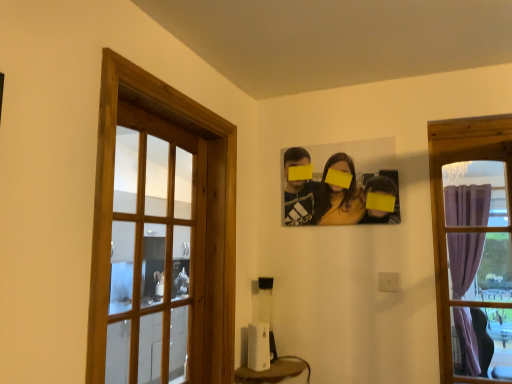
Image resolution: width=512 pixels, height=384 pixels. What are the coordinates of `vacant point above matte black photo frame at upper center (from a real-world perspective)` in the screenshot? It's located at (337, 132).